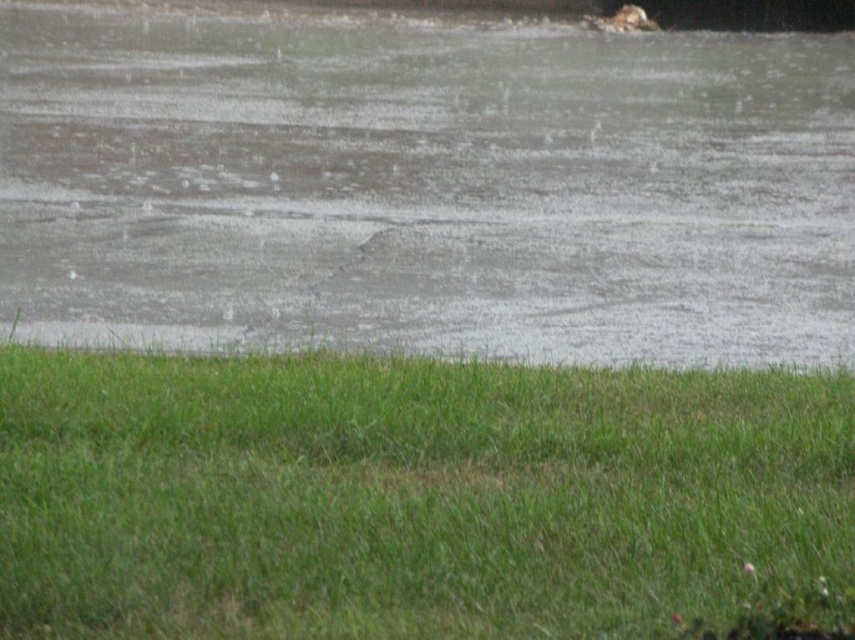
Between gray matte water at center and green grass at lower center, which one has more height?

Standing taller between the two is gray matte water at center.

Describe the element at coordinates (423, 186) in the screenshot. I see `gray matte water at center` at that location.

Locate an element on the screen. Image resolution: width=855 pixels, height=640 pixels. gray matte water at center is located at coordinates (423, 186).